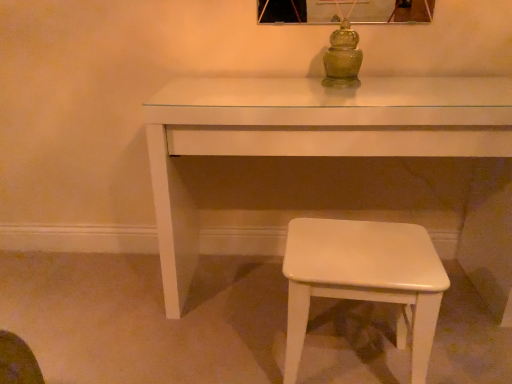
Question: Does green glass jar at center appear on the right side of white glossy table at center?

Choices:
 (A) yes
 (B) no

Answer: (B)

Question: Is green glass jar at center facing towards white glossy table at center?

Choices:
 (A) no
 (B) yes

Answer: (A)

Question: Is green glass jar at center facing away from white glossy table at center?

Choices:
 (A) no
 (B) yes

Answer: (A)

Question: Does green glass jar at center have a smaller size compared to white glossy table at center?

Choices:
 (A) yes
 (B) no

Answer: (A)

Question: Is there a large distance between green glass jar at center and white glossy table at center?

Choices:
 (A) yes
 (B) no

Answer: (B)

Question: Is point (342, 31) closer or farther from the camera than point (437, 253)?

Choices:
 (A) farther
 (B) closer

Answer: (A)

Question: Is green glass jar at center wider or thinner than white glossy stool at lower right?

Choices:
 (A) wide
 (B) thin

Answer: (B)

Question: Looking at the image, does green glass jar at center seem bigger or smaller compared to white glossy stool at lower right?

Choices:
 (A) small
 (B) big

Answer: (A)

Question: From the image's perspective, is green glass jar at center positioned above or below white glossy stool at lower right?

Choices:
 (A) above
 (B) below

Answer: (A)

Question: From their relative heights in the image, would you say green glass jar at center is taller or shorter than white glossy table at center?

Choices:
 (A) tall
 (B) short

Answer: (B)

Question: Considering their positions, is green glass jar at center located in front of or behind white glossy table at center?

Choices:
 (A) behind
 (B) front

Answer: (A)

Question: Would you say green glass jar at center is inside or outside white glossy table at center?

Choices:
 (A) inside
 (B) outside

Answer: (B)

Question: Is green glass jar at center to the left or to the right of white glossy table at center in the image?

Choices:
 (A) right
 (B) left

Answer: (B)

Question: Is white glossy stool at lower right taller or shorter than white glossy table at center?

Choices:
 (A) short
 (B) tall

Answer: (A)

Question: In terms of width, does white glossy stool at lower right look wider or thinner when compared to white glossy table at center?

Choices:
 (A) thin
 (B) wide

Answer: (A)